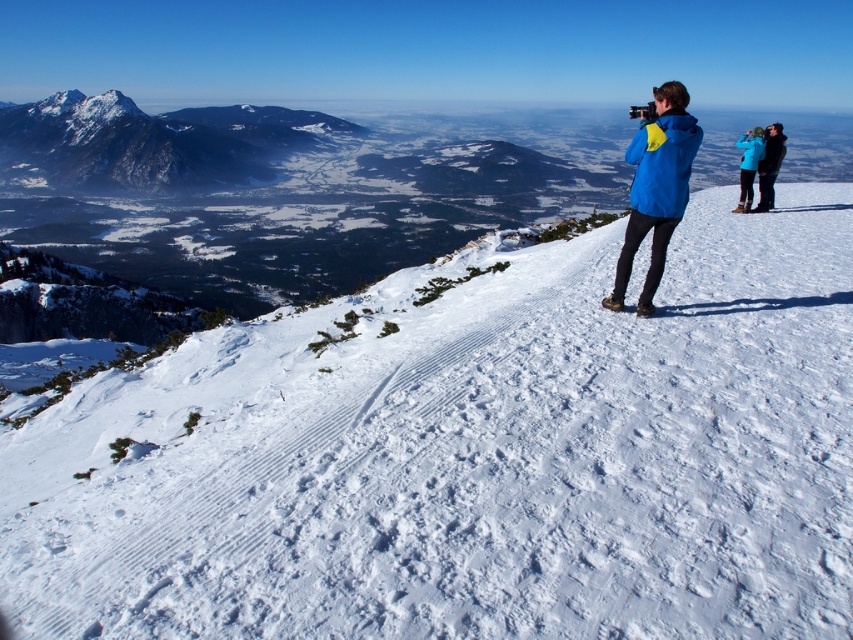
You are a photographer planning to take a photo of the white snow at upper center. To ensure the snow is in the center of your photo, where should you position your camera? Please provide coordinates based on the image grid system where the top left corner is the origin point.

The white snow at upper center is located at coordinates point (473, 458), so you should position your camera to center the photo at those coordinates.

You are a photographer standing on a snow slope and want to take a photo of two points marked in the scene. The first point is at coordinate point (126, 410) and the second point is at point (55, 136). From your current position, which point will appear closer to you in the photo?

Point (126, 410) is in front of point (55, 136), so it will appear closer to you in the photo.